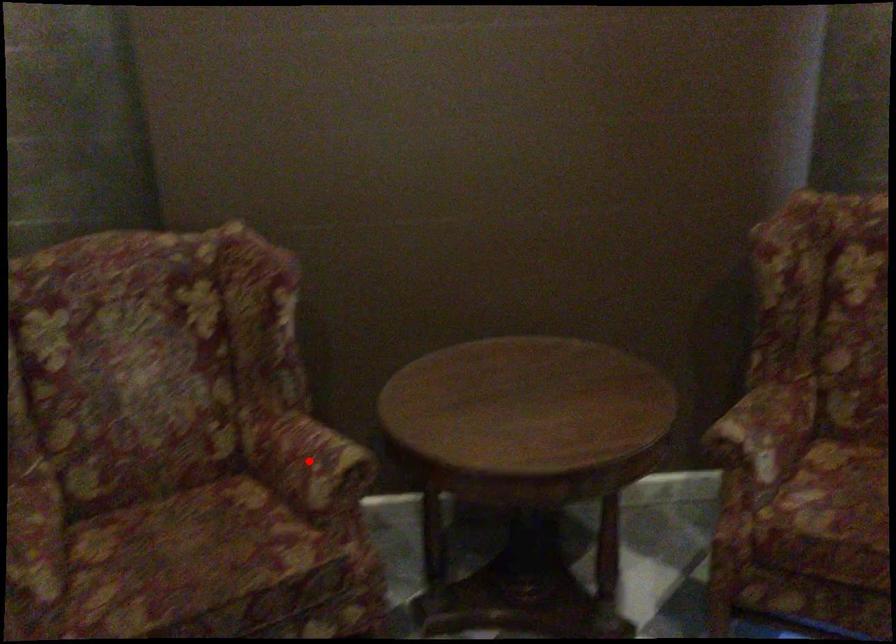
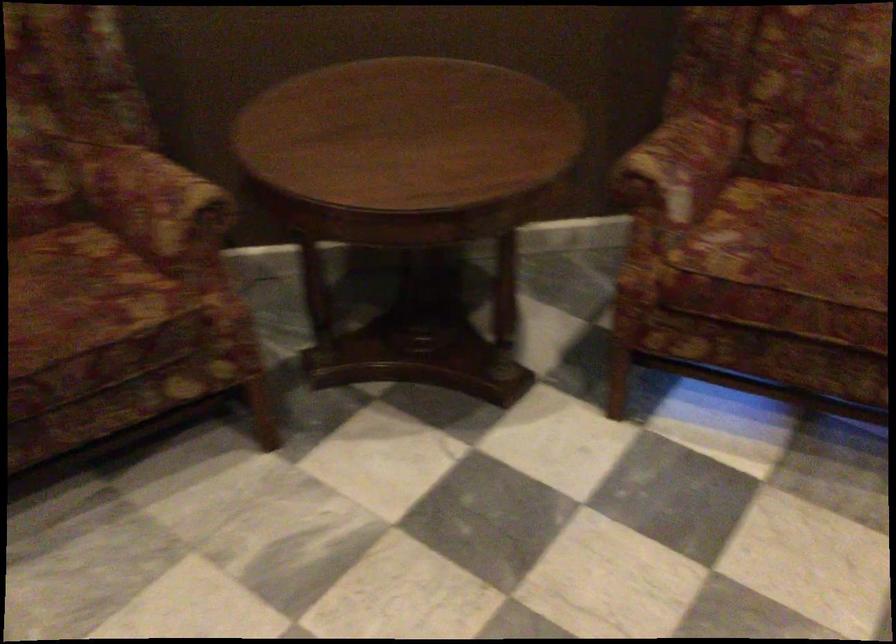
Locate, in the second image, the point that corresponds to the highlighted location in the first image.

(156, 204)